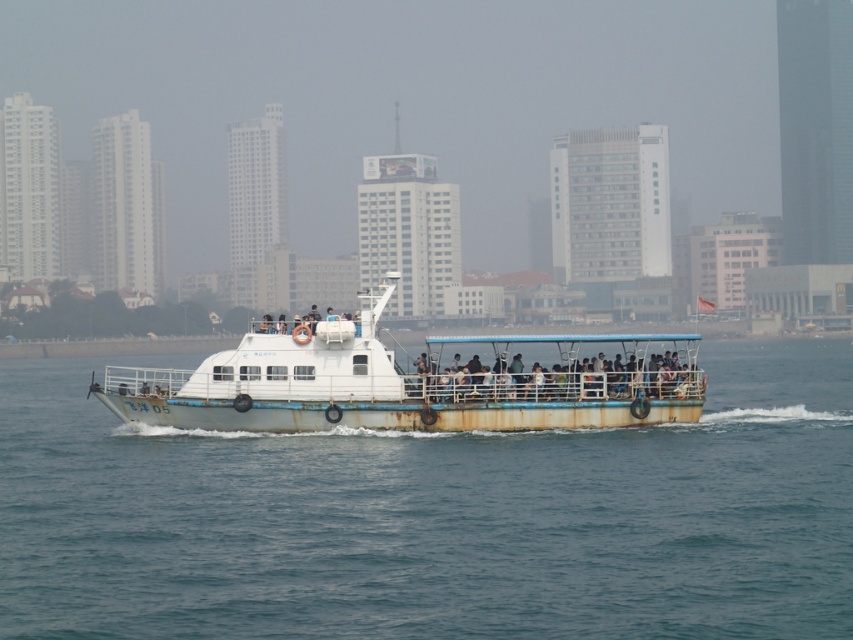
You are standing on the ferry boat and looking around. Which object is located at the coordinates point (434, 516)?

The point (434, 516) indicates blue water at center.

You are a passenger on the ferry boat and want to know the exact position of the blue water at center. Can you tell me its coordinates?

The blue water at center is located at point (434,516).